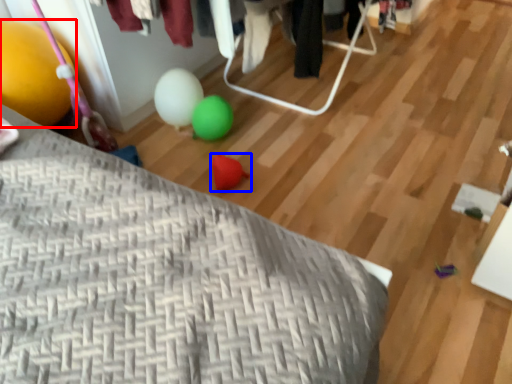
Question: Among these objects, which one is farthest to the camera, balloon (highlighted by a red box) or toy (highlighted by a blue box)?

Choices:
 (A) balloon
 (B) toy

Answer: (B)